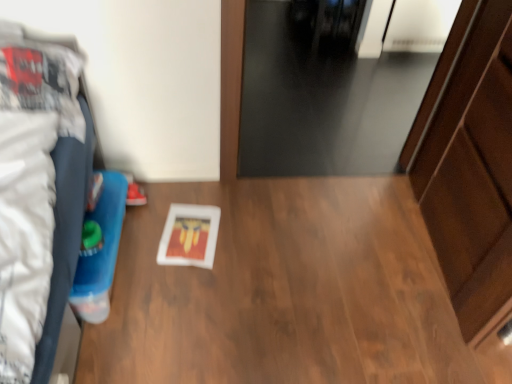
Where is `vacant space situated on the left part of wooden dresser at right`? vacant space situated on the left part of wooden dresser at right is located at coordinates (338, 248).